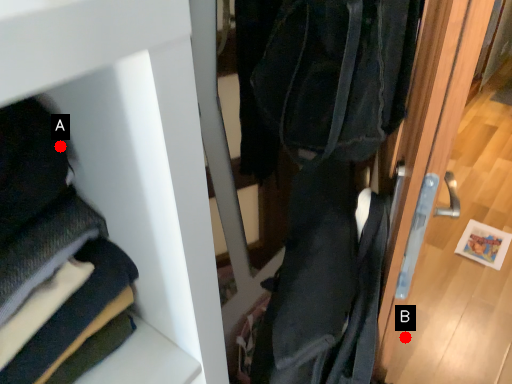
Question: Two points are circled on the image, labeled by A and B beside each circle. Which point is farther from the camera taking this photo?

Choices:
 (A) A is further
 (B) B is further

Answer: (B)